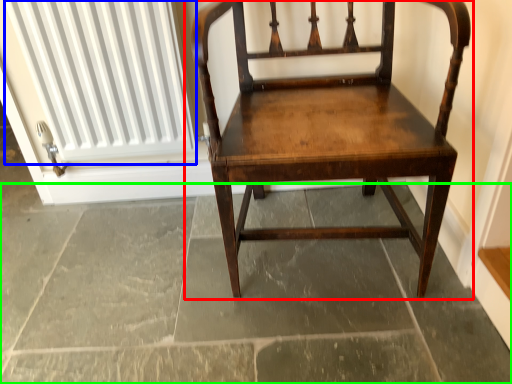
Question: Which object is the farthest from chair (highlighted by a red box)? Choose among these: radiator (highlighted by a blue box) or concrete (highlighted by a green box).

Choices:
 (A) radiator
 (B) concrete

Answer: (A)